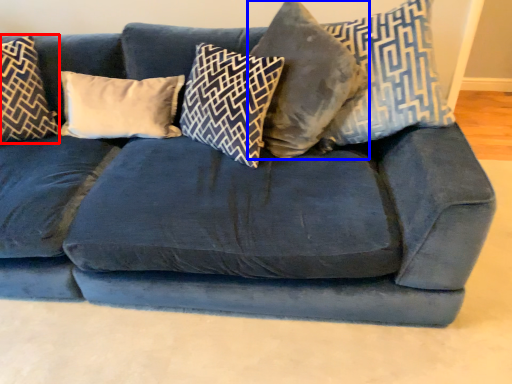
Question: Which object appears farthest to the camera in this image, pillow (highlighted by a red box) or pillow (highlighted by a blue box)?

Choices:
 (A) pillow
 (B) pillow

Answer: (A)